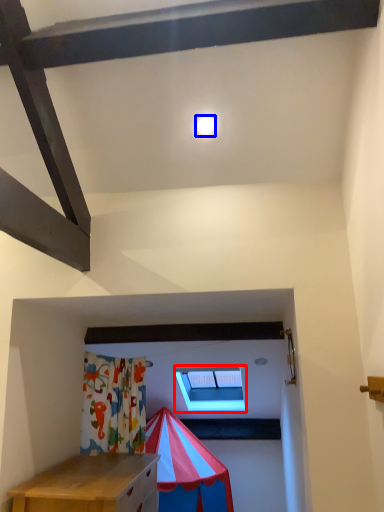
Question: Which of the following is the closest to the observer, window (highlighted by a red box) or light (highlighted by a blue box)?

Choices:
 (A) window
 (B) light

Answer: (B)